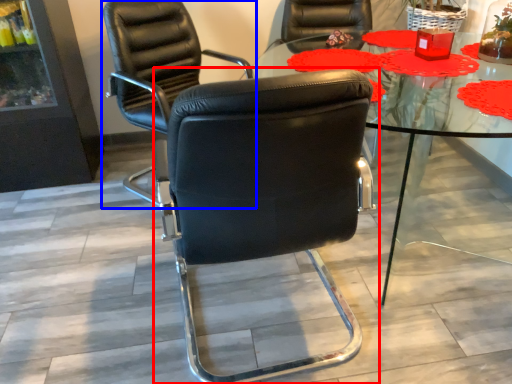
Question: Which point is closer to the camera, chair (highlighted by a red box) or chair (highlighted by a blue box)?

Choices:
 (A) chair
 (B) chair

Answer: (A)